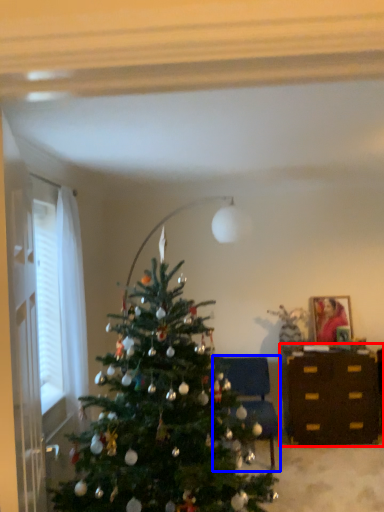
Question: Which object is further to the camera taking this photo, desk (highlighted by a red box) or furniture (highlighted by a blue box)?

Choices:
 (A) desk
 (B) furniture

Answer: (A)